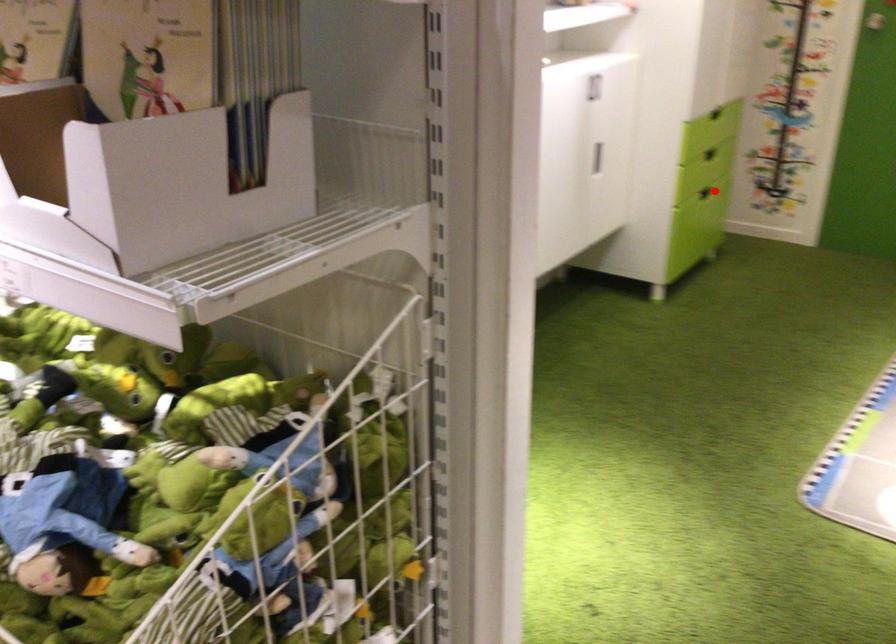
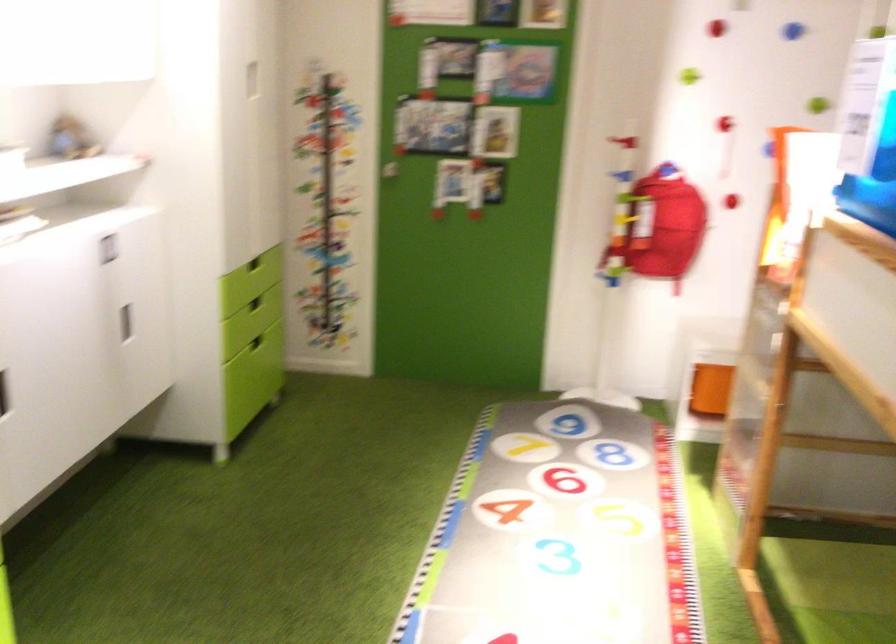
Where in the second image is the point corresponding to the highlighted location from the first image?

(255, 342)